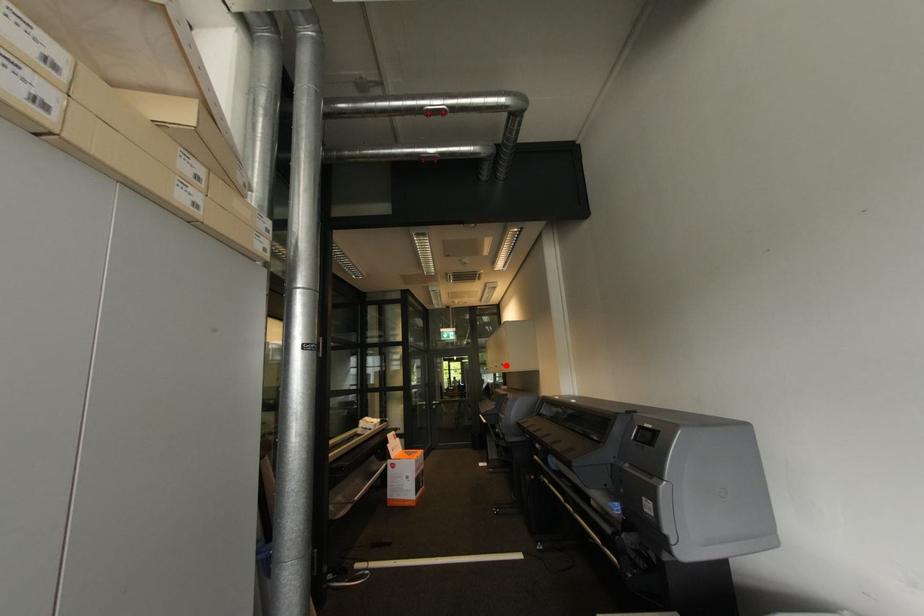
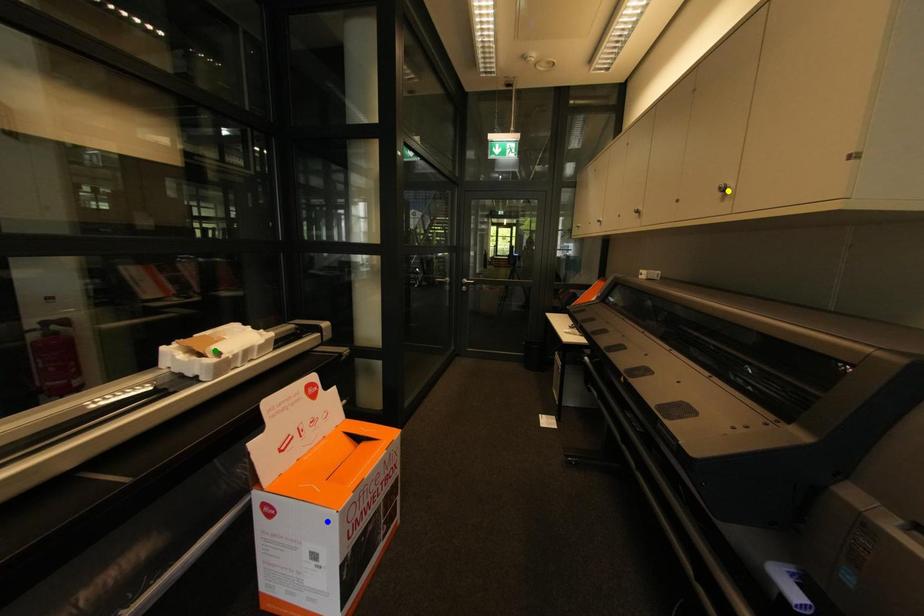
Question: I am providing you with two images of the same scene from different viewpoints. A red point is marked on the first image. You are given multiple points on the second image. In image 2, which mark is for the same physical point as the one in image 1?

Choices:
 (A) blue point
 (B) yellow point
 (C) green point

Answer: (B)